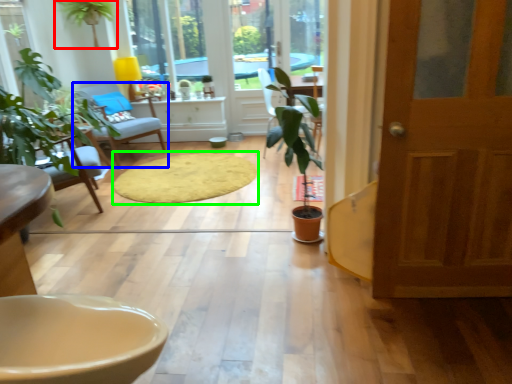
Question: Considering the real-world distances, which object is closest to houseplant (highlighted by a red box)? chair (highlighted by a blue box) or mat (highlighted by a green box).

Choices:
 (A) chair
 (B) mat

Answer: (A)